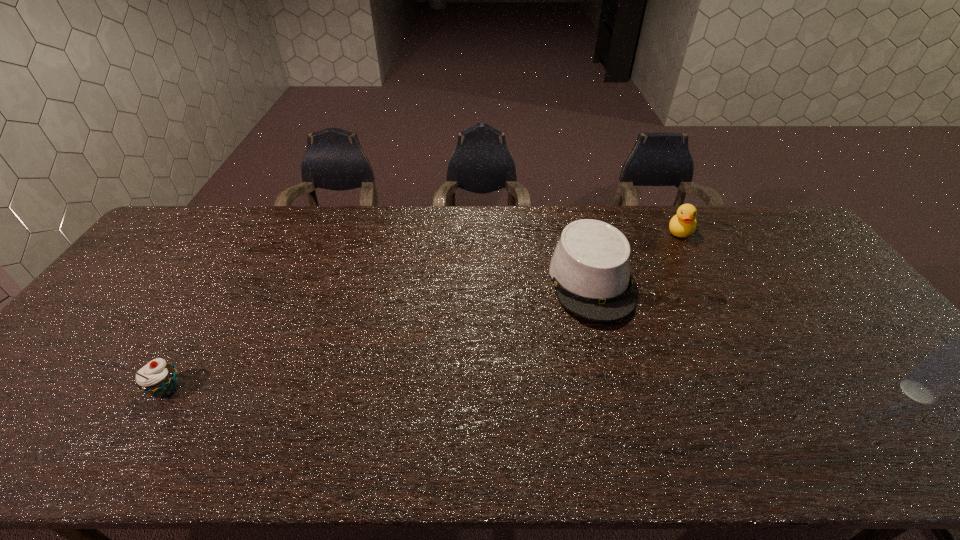
I want to click on the leftmost object, so click(x=157, y=378).

This screenshot has width=960, height=540. Identify the location of the rightmost object. (958, 360).

This screenshot has width=960, height=540. I want to click on water bottle, so click(x=958, y=360).

Locate an element on the screen. The width and height of the screenshot is (960, 540). the second farthest object is located at coordinates (590, 268).

Where is `the third object from right to left`? the third object from right to left is located at coordinates (590, 268).

This screenshot has height=540, width=960. What are the coordinates of `duckling` in the screenshot? It's located at (683, 224).

Where is `the third object from left to right`? The width and height of the screenshot is (960, 540). the third object from left to right is located at coordinates (x=683, y=224).

In order to click on vacant position located 0.150m on the right of the cupcake in this screenshot , I will do `click(248, 389)`.

The width and height of the screenshot is (960, 540). I want to click on free region located on the left of the tallest object, so click(860, 392).

Where is `vacant space located 0.120m on the front-facing side of the second object from left to right`? Image resolution: width=960 pixels, height=540 pixels. vacant space located 0.120m on the front-facing side of the second object from left to right is located at coordinates [x=615, y=364].